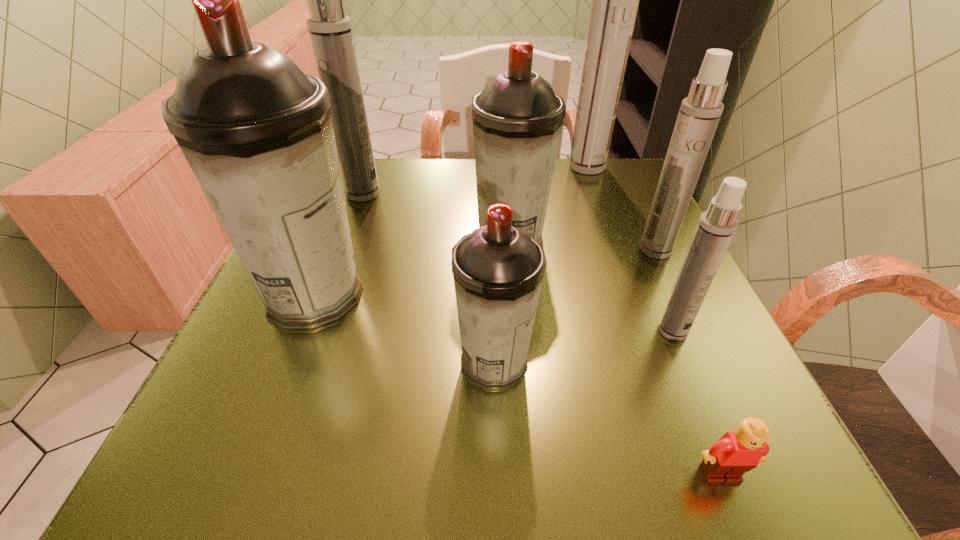
Locate an element on the screen. The width and height of the screenshot is (960, 540). aerosol can that is the fourth closest to the shortest object is located at coordinates (517, 118).

Select which aerosol can is the closest to the second nearest white aerosol can. Please provide its 2D coordinates. Your answer should be formatted as a tuple, i.e. [(x, y)], where the tuple contains the x and y coordinates of a point satisfying the conditions above.

[(716, 227)]

Select which white aerosol can is the third closest to the second nearest white aerosol can. Please provide its 2D coordinates. Your answer should be formatted as a tuple, i.e. [(x, y)], where the tuple contains the x and y coordinates of a point satisfying the conditions above.

[(330, 30)]

At what (x,y) coordinates should I click in order to perform the action: click on white aerosol can that is the second nearest to the shortest object. Please return your answer as a coordinate pair (x, y). Image resolution: width=960 pixels, height=540 pixels. Looking at the image, I should click on (699, 114).

Locate an element on the screen. The width and height of the screenshot is (960, 540). gray aerosol can that stands as the closest to the tallest aerosol can is located at coordinates (517, 118).

Image resolution: width=960 pixels, height=540 pixels. I want to click on the second closest gray aerosol can to the farthest aerosol can, so click(x=498, y=269).

In order to click on free space that satisfies the following two spatial constraints: 1. on the front side of the leftmost white aerosol can; 2. on the left side of the third biggest white aerosol can in this screenshot , I will do `click(342, 250)`.

Find the location of a particular element. The width and height of the screenshot is (960, 540). vacant space that satisfies the following two spatial constraints: 1. on the back side of the nearest white aerosol can; 2. on the left side of the smallest gray aerosol can is located at coordinates (493, 330).